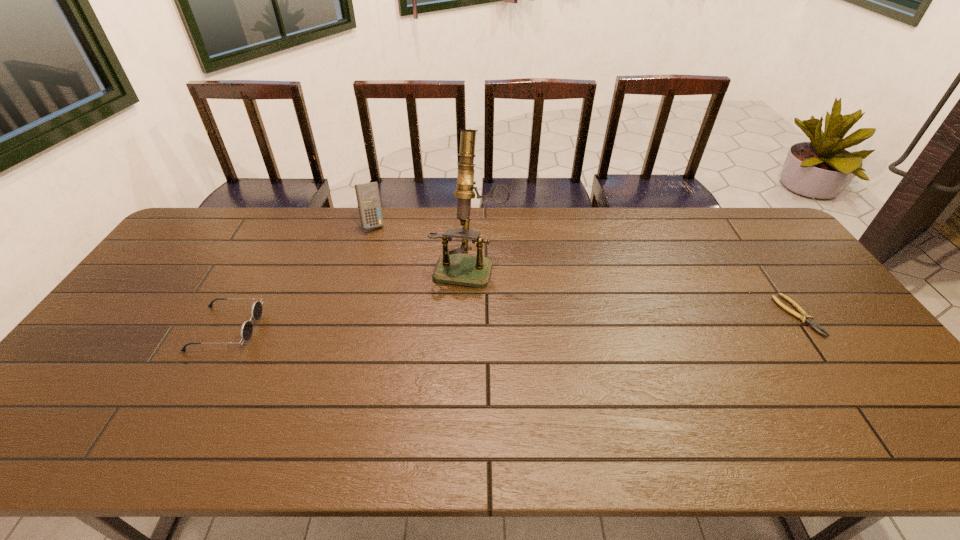
Locate an element on the screen. the second shortest object is located at coordinates (246, 330).

At what (x,y) coordinates should I click in order to perform the action: click on sunglasses. Please return your answer as a coordinate pair (x, y). Looking at the image, I should click on (246, 330).

Where is `the shortest object`? This screenshot has height=540, width=960. the shortest object is located at coordinates (803, 316).

Locate an element on the screen. The width and height of the screenshot is (960, 540). pliers is located at coordinates (803, 316).

Locate an element on the screen. the third nearest object is located at coordinates (452, 268).

At what (x,y) coordinates should I click in order to perform the action: click on microscope. Please return your answer as a coordinate pair (x, y). The image size is (960, 540). Looking at the image, I should click on tap(452, 268).

Where is `calculator`? This screenshot has width=960, height=540. calculator is located at coordinates (368, 198).

Find the location of a particular element. The height and width of the screenshot is (540, 960). the farthest object is located at coordinates (368, 198).

At what (x,y) coordinates should I click in order to perform the action: click on free spot located 0.300m on the front-facing side of the second shortest object. Please return your answer as a coordinate pair (x, y). The image size is (960, 540). Looking at the image, I should click on (367, 328).

The width and height of the screenshot is (960, 540). What are the coordinates of `vacant point located on the back of the pliers` in the screenshot? It's located at (754, 254).